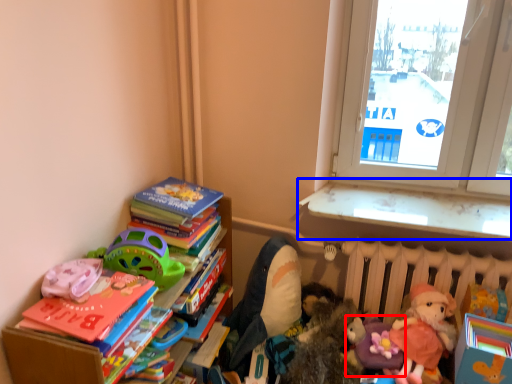
Question: Which object is further to the camera taking this photo, toy (highlighted by a red box) or window sill (highlighted by a blue box)?

Choices:
 (A) toy
 (B) window sill

Answer: (B)